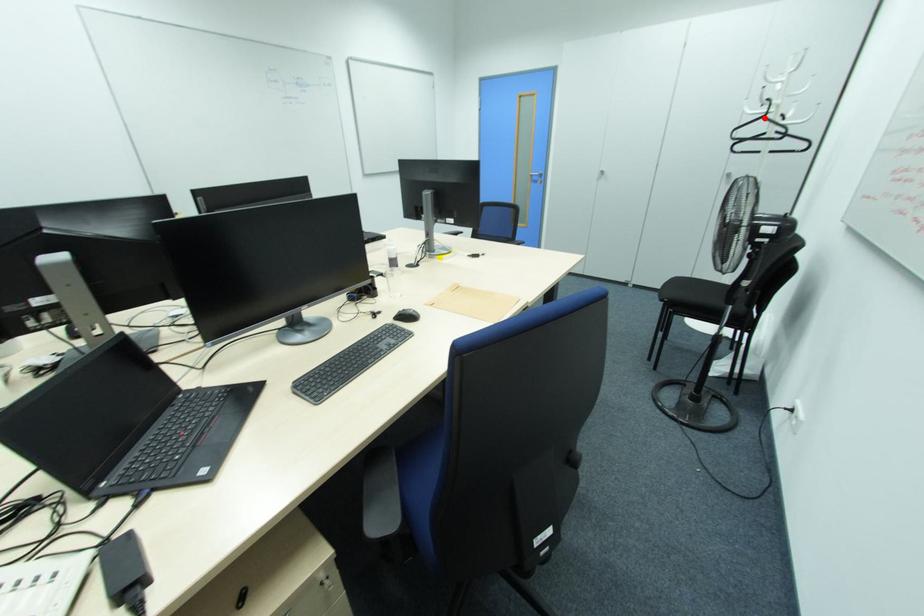
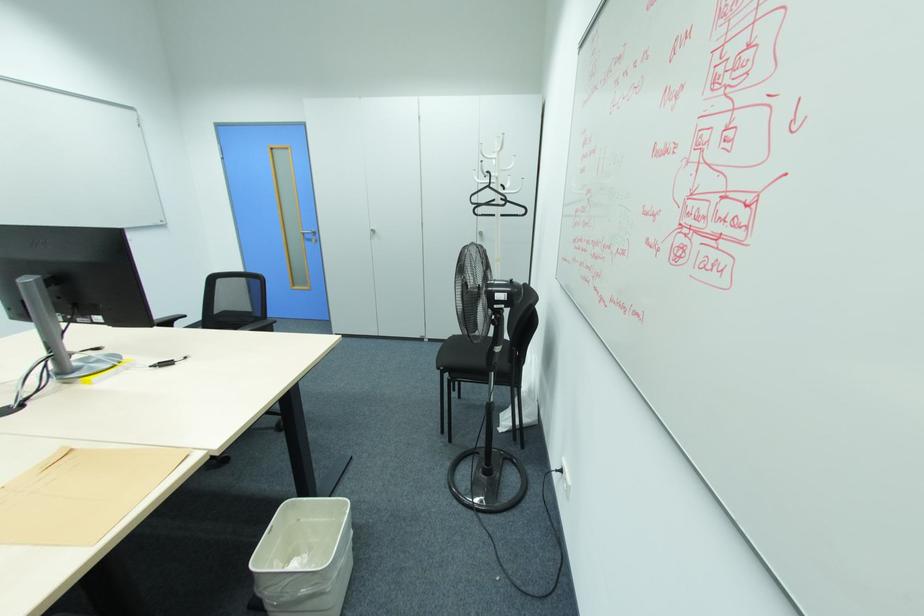
In the second image, find the point that corresponds to the highlighted location in the first image.

(490, 187)